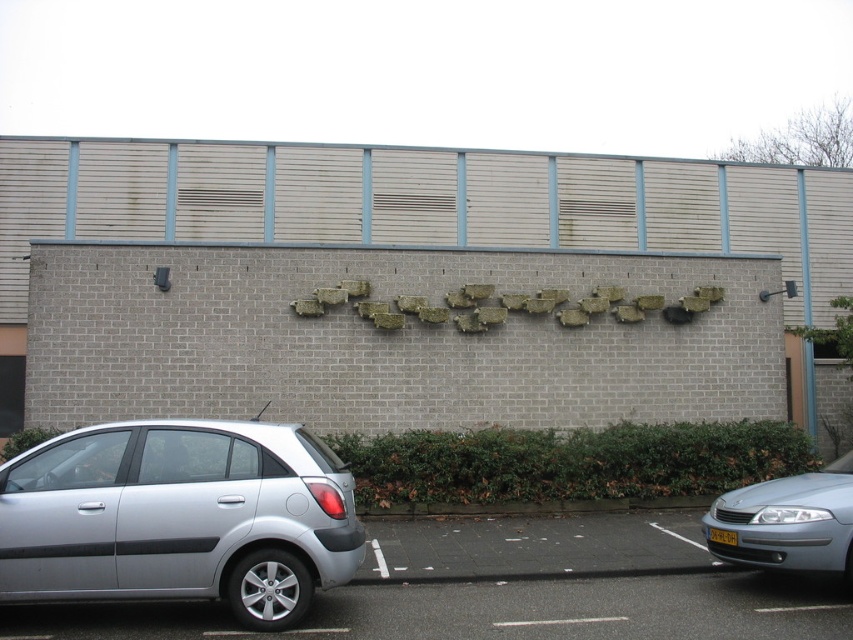
Looking at this image, you are standing in front of the building and want to walk towards the wall. There are two points marked on the ground. The first point is at point (51,598) and the second is at point (769,541). Which point is closer to you as you face the wall?

Point (51,598) is closer to you because it is in front of point (769,541).

You are standing at the viewpoint of the image and want to place a small sculpture between the two points labeled point (469, 582) and point (846, 534). Which point should the sculpture be placed closer to so that it is in front of the other point?

The sculpture should be placed closer to point (846, 534) because point (469, 582) is behind point (846, 534), so placing it near the front point ensures visibility.